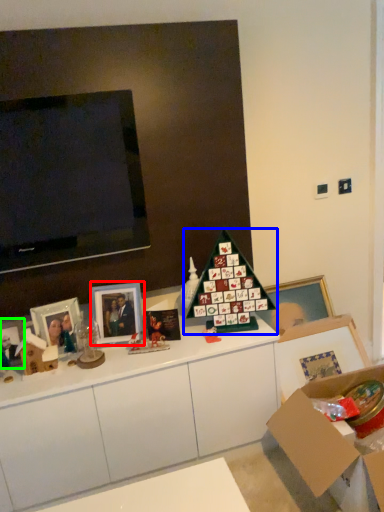
Question: Which object is the farthest from picture frame (highlighted by a red box)? Choose among these: christmas tree (highlighted by a blue box) or picture frame (highlighted by a green box).

Choices:
 (A) christmas tree
 (B) picture frame

Answer: (B)